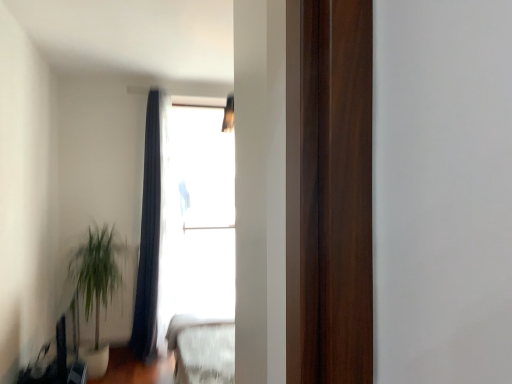
Question: Does dark blue fabric curtain at upper center touch green leafy plant at lower left?

Choices:
 (A) no
 (B) yes

Answer: (A)

Question: Is the depth of dark blue fabric curtain at upper center greater than that of green leafy plant at lower left?

Choices:
 (A) yes
 (B) no

Answer: (A)

Question: From the image's perspective, is dark blue fabric curtain at upper center above green leafy plant at lower left?

Choices:
 (A) no
 (B) yes

Answer: (B)

Question: Is dark blue fabric curtain at upper center at the left side of green leafy plant at lower left?

Choices:
 (A) yes
 (B) no

Answer: (B)

Question: Does dark blue fabric curtain at upper center have a lesser width compared to green leafy plant at lower left?

Choices:
 (A) no
 (B) yes

Answer: (B)

Question: Is dark blue fabric curtain at upper center oriented away from green leafy plant at lower left?

Choices:
 (A) no
 (B) yes

Answer: (A)

Question: Is green leafy plant at lower left positioned with its back to transparent glass window at upper center?

Choices:
 (A) no
 (B) yes

Answer: (A)

Question: Is green leafy plant at lower left at the left side of transparent glass window at upper center?

Choices:
 (A) no
 (B) yes

Answer: (B)

Question: Considering the relative sizes of green leafy plant at lower left and transparent glass window at upper center in the image provided, is green leafy plant at lower left smaller than transparent glass window at upper center?

Choices:
 (A) yes
 (B) no

Answer: (B)

Question: Is green leafy plant at lower left oriented towards transparent glass window at upper center?

Choices:
 (A) no
 (B) yes

Answer: (B)

Question: From the image's perspective, does green leafy plant at lower left appear lower than transparent glass window at upper center?

Choices:
 (A) yes
 (B) no

Answer: (A)

Question: From a real-world perspective, is green leafy plant at lower left positioned under transparent glass window at upper center based on gravity?

Choices:
 (A) no
 (B) yes

Answer: (B)

Question: Is green leafy plant at lower left surrounded by transparent glass window at upper center?

Choices:
 (A) no
 (B) yes

Answer: (A)